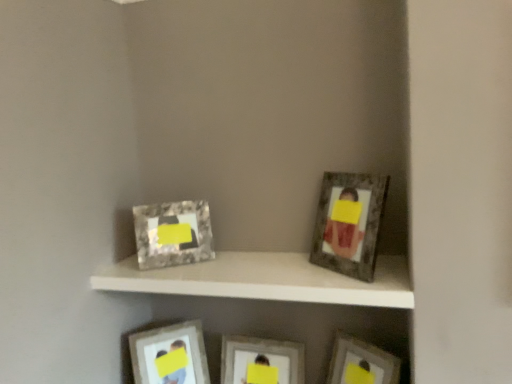
Question: Can you confirm if marble-like frame at upper left, positioned as the 2th picture frame in left-to-right order, is thinner than metallic silver picture frame at lower right, which ranks as the 1th picture frame in right-to-left order?

Choices:
 (A) yes
 (B) no

Answer: (A)

Question: Can you confirm if marble-like frame at upper left, the fourth picture frame positioned from the right, is positioned to the right of metallic silver picture frame at lower right, which ranks as the 1th picture frame in right-to-left order?

Choices:
 (A) yes
 (B) no

Answer: (B)

Question: Considering the relative sizes of marble-like frame at upper left, the fourth picture frame positioned from the right, and metallic silver picture frame at lower right, acting as the 5th picture frame starting from the left, in the image provided, is marble-like frame at upper left, the fourth picture frame positioned from the right, taller than metallic silver picture frame at lower right, acting as the 5th picture frame starting from the left,?

Choices:
 (A) no
 (B) yes

Answer: (B)

Question: Can you confirm if marble-like frame at upper left, positioned as the 2th picture frame in left-to-right order, is positioned to the left of metallic silver picture frame at lower right, acting as the 5th picture frame starting from the left?

Choices:
 (A) yes
 (B) no

Answer: (A)

Question: Is marble-like frame at upper left, the fourth picture frame positioned from the right, outside of metallic silver picture frame at lower right, which ranks as the 1th picture frame in right-to-left order?

Choices:
 (A) no
 (B) yes

Answer: (B)

Question: Relative to matte silver picture frame at center, arranged as the third picture frame when viewed from the left, is matte silver picture frame at lower center, acting as the fifth picture frame starting from the right, in front or behind?

Choices:
 (A) behind
 (B) front

Answer: (A)

Question: Looking at their shapes, would you say matte silver picture frame at lower center, the first picture frame when ordered from left to right, is wider or thinner than matte silver picture frame at center, arranged as the third picture frame when viewed from the left?

Choices:
 (A) wide
 (B) thin

Answer: (B)

Question: Is matte silver picture frame at lower center, the first picture frame when ordered from left to right, taller or shorter than matte silver picture frame at center, arranged as the third picture frame when viewed from the left?

Choices:
 (A) short
 (B) tall

Answer: (B)

Question: From a real-world perspective, is matte silver picture frame at lower center, acting as the fifth picture frame starting from the right, above or below matte silver picture frame at center, which ranks as the third picture frame in right-to-left order?

Choices:
 (A) below
 (B) above

Answer: (B)

Question: From a real-world perspective, is matte silver picture frame at upper right, which is the second picture frame from right to left, positioned above or below marble-like frame at upper left, the fourth picture frame positioned from the right?

Choices:
 (A) above
 (B) below

Answer: (A)

Question: Does point (373, 205) appear closer or farther from the camera than point (152, 220)?

Choices:
 (A) closer
 (B) farther

Answer: (A)

Question: Considering the positions of matte silver picture frame at upper right, positioned as the 4th picture frame in left-to-right order, and marble-like frame at upper left, the fourth picture frame positioned from the right, in the image, is matte silver picture frame at upper right, positioned as the 4th picture frame in left-to-right order, taller or shorter than marble-like frame at upper left, the fourth picture frame positioned from the right,?

Choices:
 (A) tall
 (B) short

Answer: (A)

Question: From the image's perspective, is matte silver picture frame at upper right, positioned as the 4th picture frame in left-to-right order, located above or below marble-like frame at upper left, the fourth picture frame positioned from the right?

Choices:
 (A) above
 (B) below

Answer: (A)

Question: Visually, is matte silver picture frame at lower center, the first picture frame when ordered from left to right, positioned to the left or to the right of matte silver picture frame at upper right, which is the second picture frame from right to left?

Choices:
 (A) right
 (B) left

Answer: (B)

Question: Is point (189, 329) positioned closer to the camera than point (331, 193)?

Choices:
 (A) closer
 (B) farther

Answer: (B)